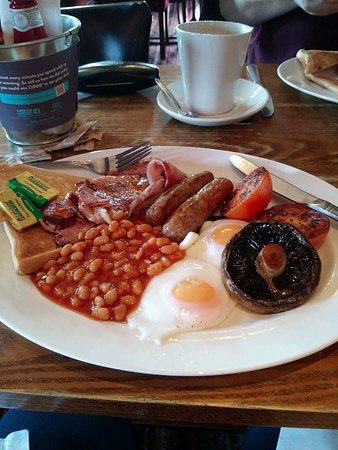
The image size is (338, 450). In order to click on brown table in this screenshot , I will do `click(297, 401)`.